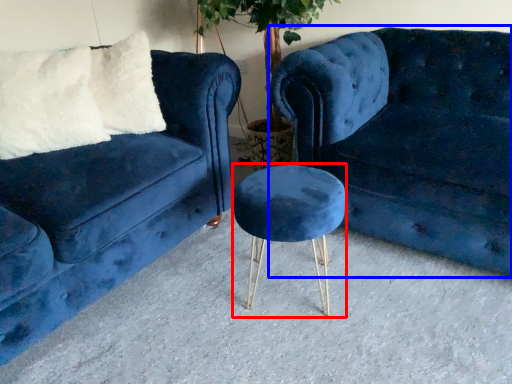
Question: Which object is closer to the camera taking this photo, bar stool (highlighted by a red box) or studio couch (highlighted by a blue box)?

Choices:
 (A) bar stool
 (B) studio couch

Answer: (B)